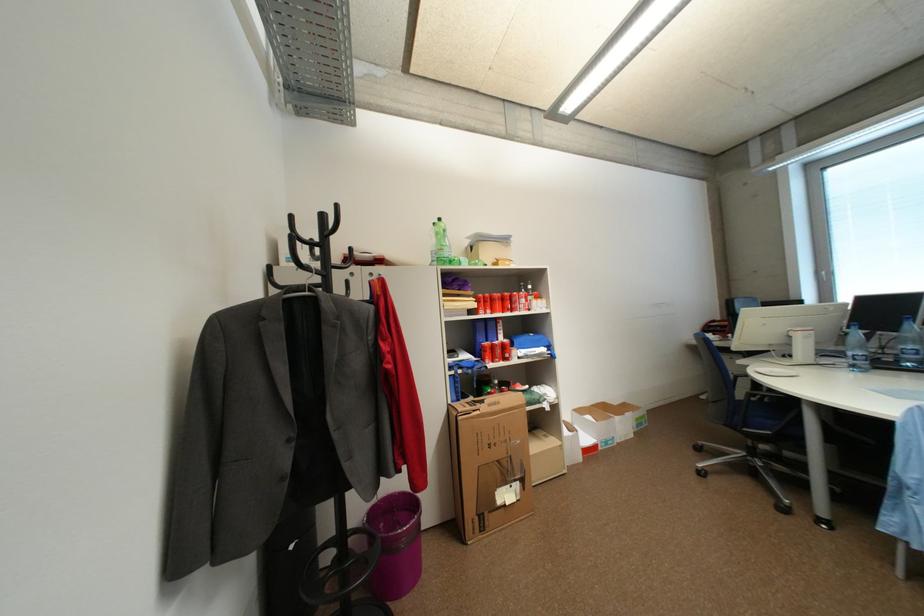
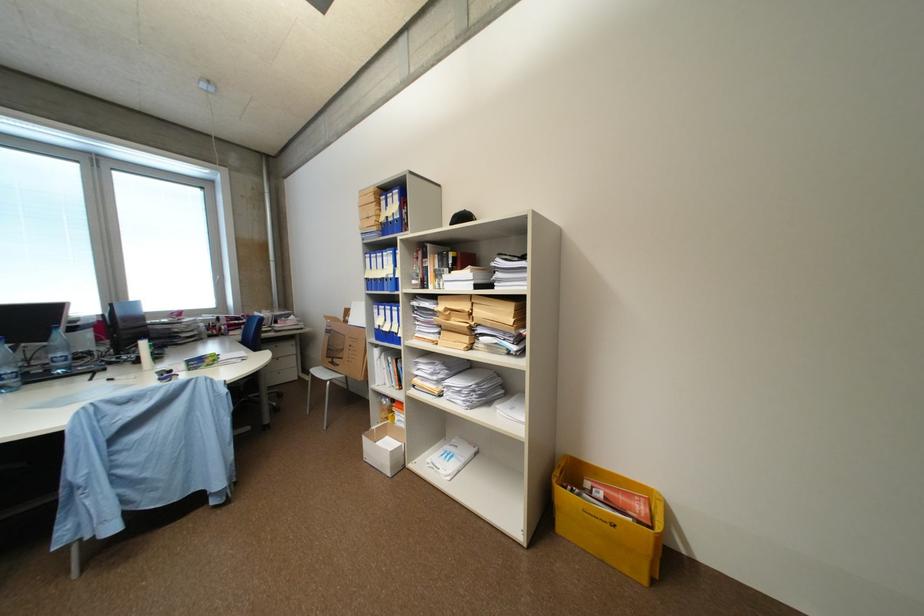
Where in the second image is the point corresponding to point 861,367 from the first image?

(10, 389)